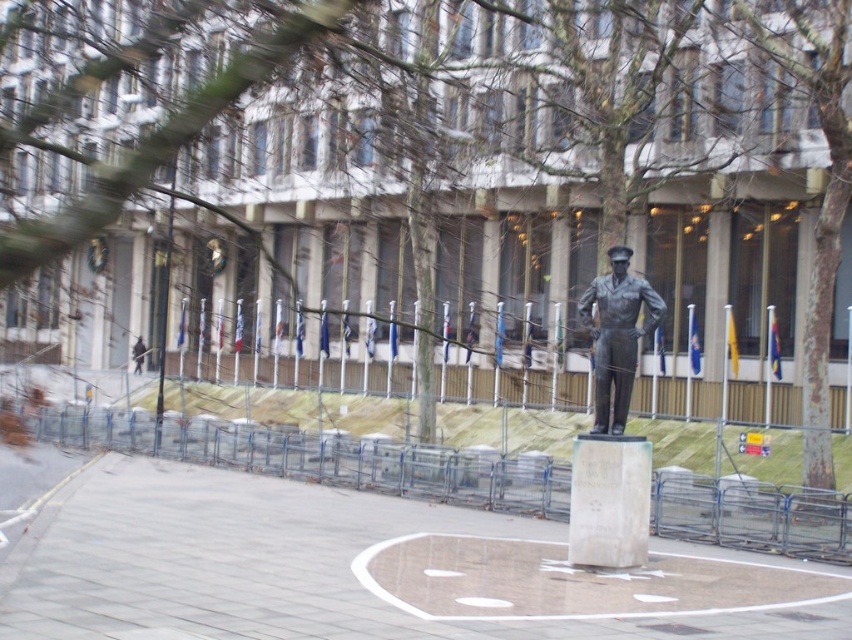
Question: Does white marble stone at center appear on the left side of bronze statue at center?

Choices:
 (A) no
 (B) yes

Answer: (B)

Question: Which point is closer to the camera?

Choices:
 (A) (577, 552)
 (B) (640, 296)

Answer: (A)

Question: Does white marble stone at center have a smaller size compared to bronze statue at center?

Choices:
 (A) no
 (B) yes

Answer: (A)

Question: Which point is closer to the camera?

Choices:
 (A) (619, 404)
 (B) (617, 564)

Answer: (B)

Question: In this image, where is white marble stone at center located relative to bronze statue at center?

Choices:
 (A) below
 (B) above

Answer: (A)